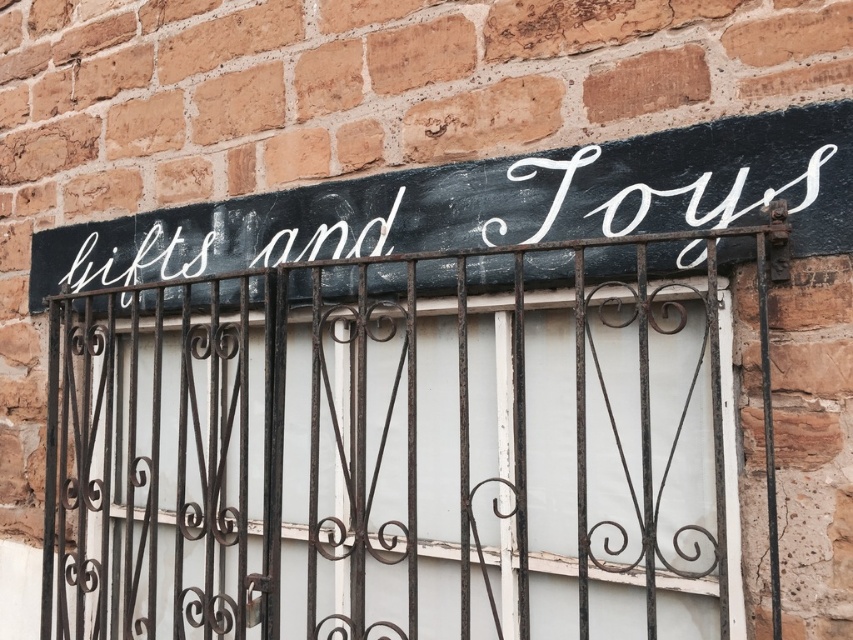
Question: Considering the real-world distances, which object is closest to the rusty metal bars at center?

Choices:
 (A) white painted wood sign at upper center
 (B) white painted sign at upper center

Answer: (A)

Question: Estimate the real-world distances between objects in this image. Which object is farther from the white painted sign at upper center?

Choices:
 (A) rusty metal bars at center
 (B) white painted wood sign at upper center

Answer: (A)

Question: Which point is closer to the camera?

Choices:
 (A) (489, 244)
 (B) (380, 628)
 (C) (809, 147)

Answer: (C)

Question: Is rusty metal bars at center positioned in front of white painted wood sign at upper center?

Choices:
 (A) yes
 (B) no

Answer: (A)

Question: Can you confirm if rusty metal bars at center is positioned above white painted sign at upper center?

Choices:
 (A) yes
 (B) no

Answer: (B)

Question: Can you confirm if rusty metal bars at center is positioned above white painted wood sign at upper center?

Choices:
 (A) yes
 (B) no

Answer: (B)